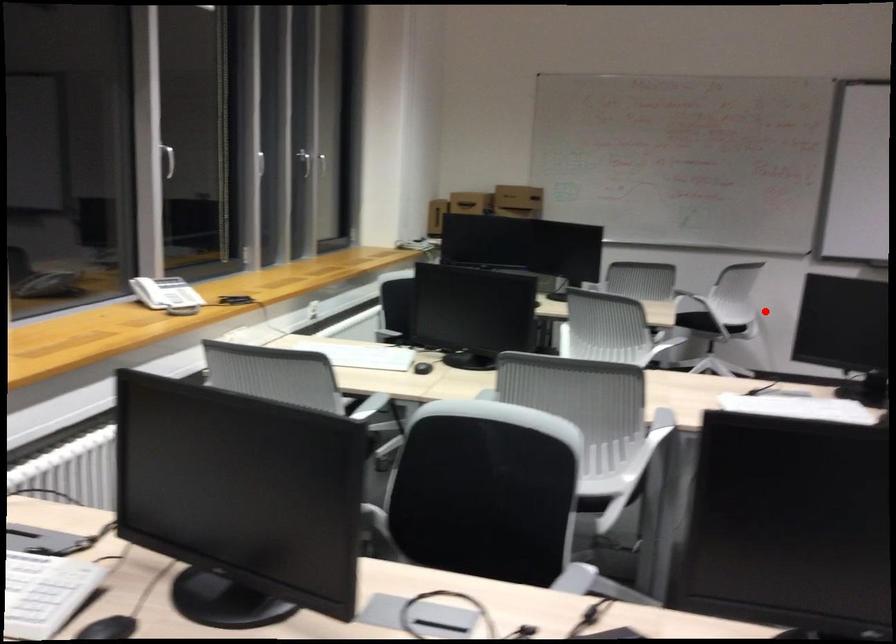
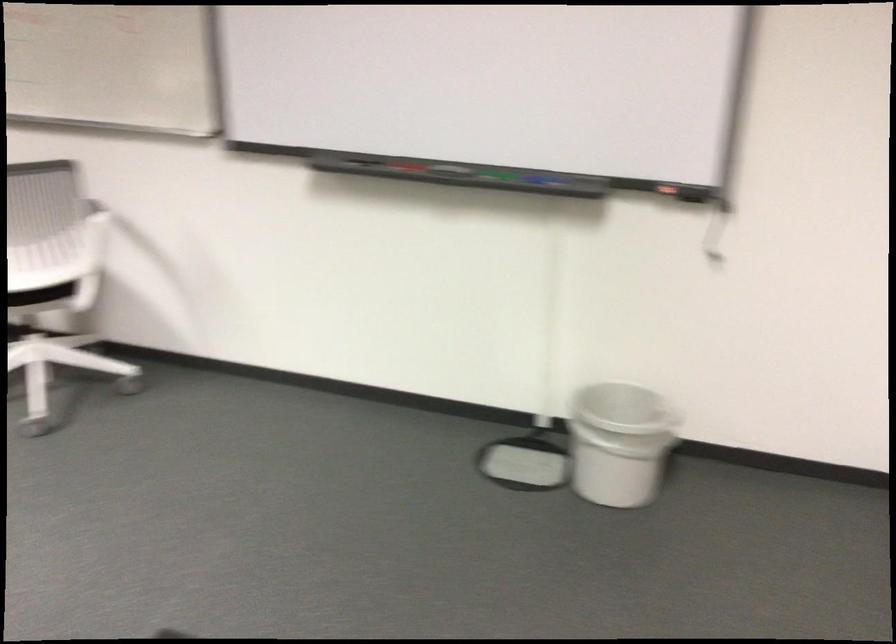
Where in the second image is the point corresponding to the highlighted location from the first image?

(40, 295)